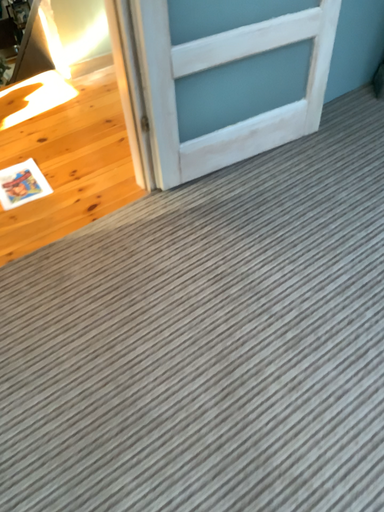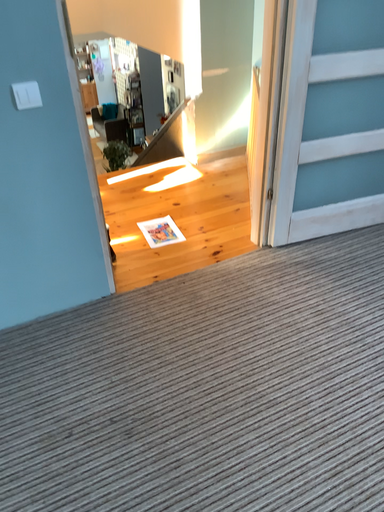
Question: Which way did the camera rotate in the video?

Choices:
 (A) rotated right
 (B) rotated left

Answer: (B)